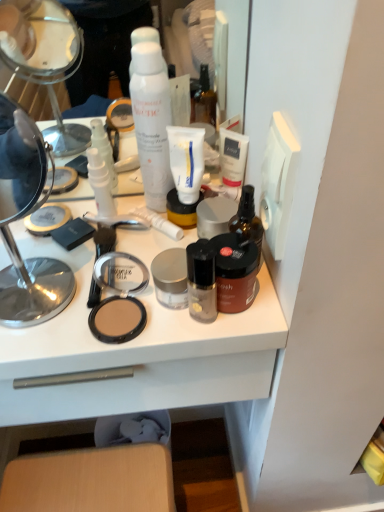
This screenshot has width=384, height=512. Find the location of `free space in front of white matte shaving cream at center`. free space in front of white matte shaving cream at center is located at coordinates (129, 289).